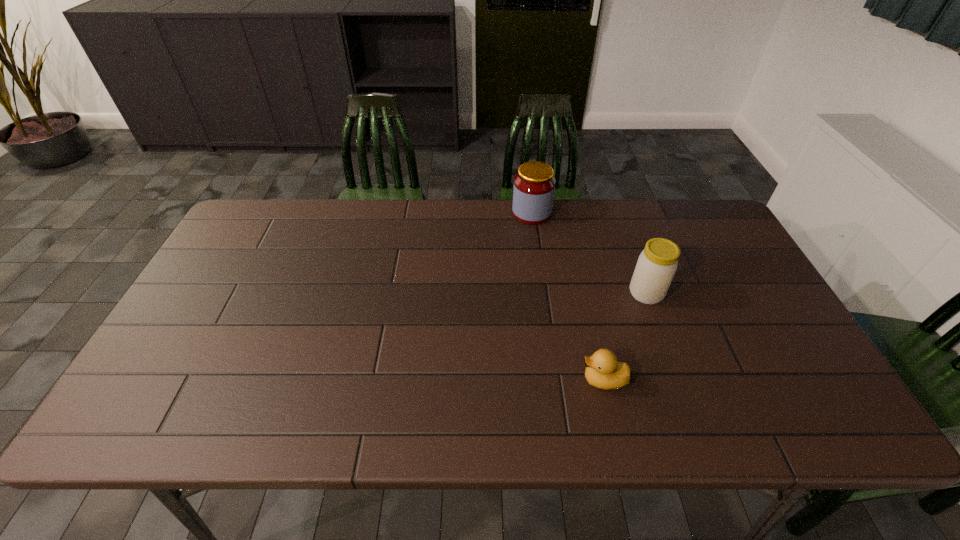
Where is `empty space between the rightmost object and the farther jar`? Image resolution: width=960 pixels, height=540 pixels. empty space between the rightmost object and the farther jar is located at coordinates (588, 253).

Where is `empty space that is in between the farthest object and the rightmost object`? The width and height of the screenshot is (960, 540). empty space that is in between the farthest object and the rightmost object is located at coordinates (588, 253).

Where is `vacant space that is in between the nearer jar and the nearest object`? This screenshot has width=960, height=540. vacant space that is in between the nearer jar and the nearest object is located at coordinates (625, 336).

This screenshot has height=540, width=960. I want to click on vacant space that is in between the farthest object and the nearer jar, so tap(588, 253).

The image size is (960, 540). Identify the location of free space between the nearest object and the right jar. (625, 336).

At what (x,y) coordinates should I click in order to perform the action: click on vacant area between the nearer jar and the shortest object. Please return your answer as a coordinate pair (x, y). The height and width of the screenshot is (540, 960). Looking at the image, I should click on (625, 336).

Identify which object is the closest to the duckling. Please provide its 2D coordinates. Your answer should be formatted as a tuple, i.e. [(x, y)], where the tuple contains the x and y coordinates of a point satisfying the conditions above.

[(657, 264)]

What are the coordinates of `the closest object relative to the rightmost object` in the screenshot? It's located at (603, 370).